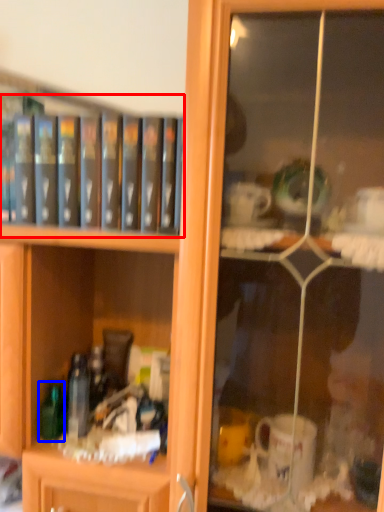
Question: Which point is closer to the camera, book (highlighted by a red box) or bottle (highlighted by a blue box)?

Choices:
 (A) book
 (B) bottle

Answer: (A)